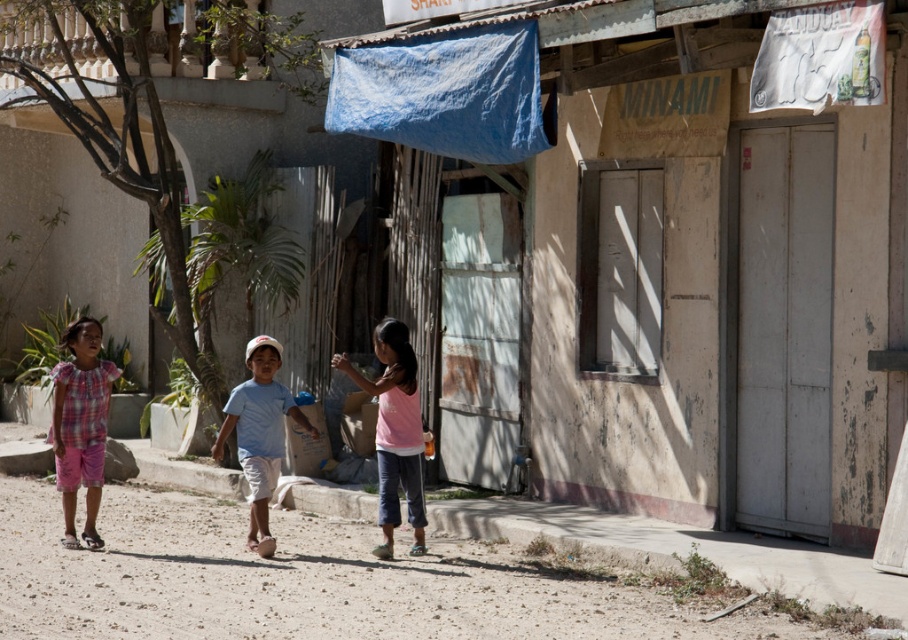
Question: Is rusty metal hut at center bigger than light blue cotton shirt at center?

Choices:
 (A) yes
 (B) no

Answer: (A)

Question: Which point is closer to the camera?

Choices:
 (A) pink fabric shirt at center
 (B) plaid cotton dress at left
 (C) blue fabric tarp at upper center

Answer: (C)

Question: Can you confirm if blue fabric tarp at upper center is bigger than light blue cotton shirt at center?

Choices:
 (A) no
 (B) yes

Answer: (B)

Question: Which object is the farthest from the light blue cotton shirt at center?

Choices:
 (A) blue fabric tarp at upper center
 (B) rusty metal hut at center

Answer: (B)

Question: Which object is farther from the camera taking this photo?

Choices:
 (A) light blue cotton shirt at center
 (B) pink fabric shirt at center
 (C) plaid cotton dress at left

Answer: (C)

Question: Is rusty metal hut at center to the right of blue fabric tarp at upper center from the viewer's perspective?

Choices:
 (A) no
 (B) yes

Answer: (B)